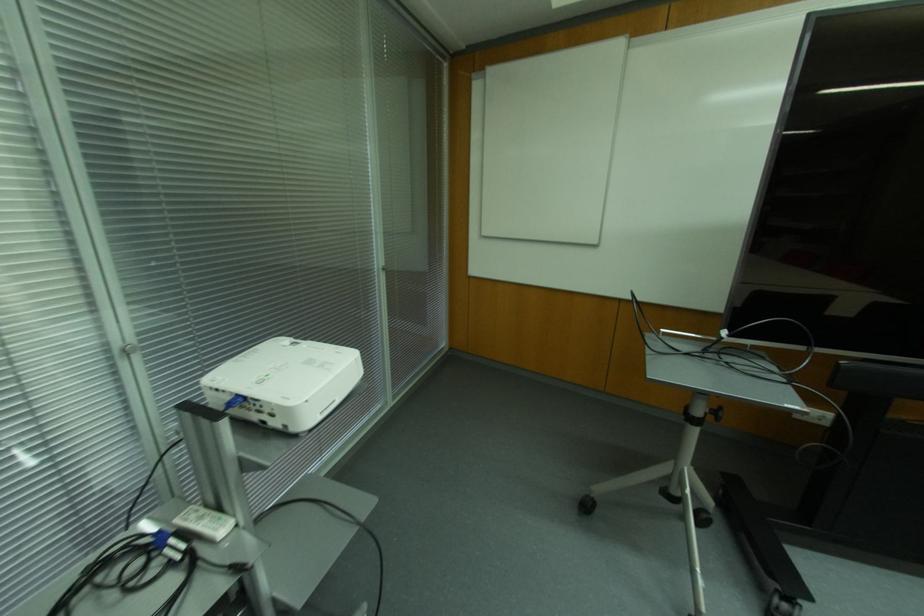
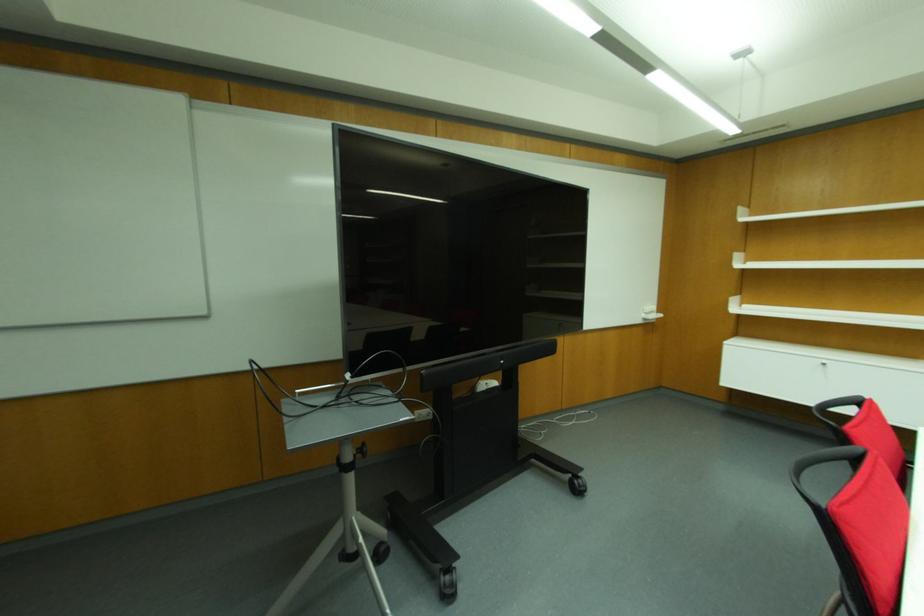
In the second image, find the point that corresponds to (x=714, y=411) in the first image.

(360, 450)